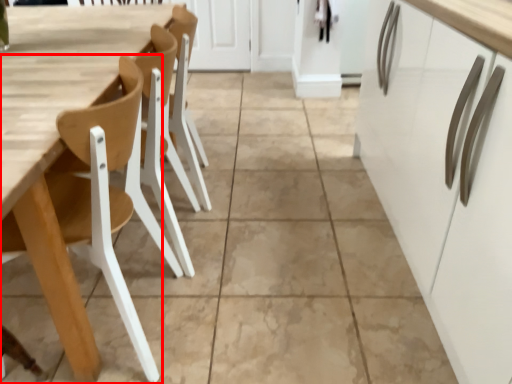
Question: From the image's perspective, where is chair (annotated by the red box) located in relation to table in the image?

Choices:
 (A) above
 (B) below

Answer: (B)